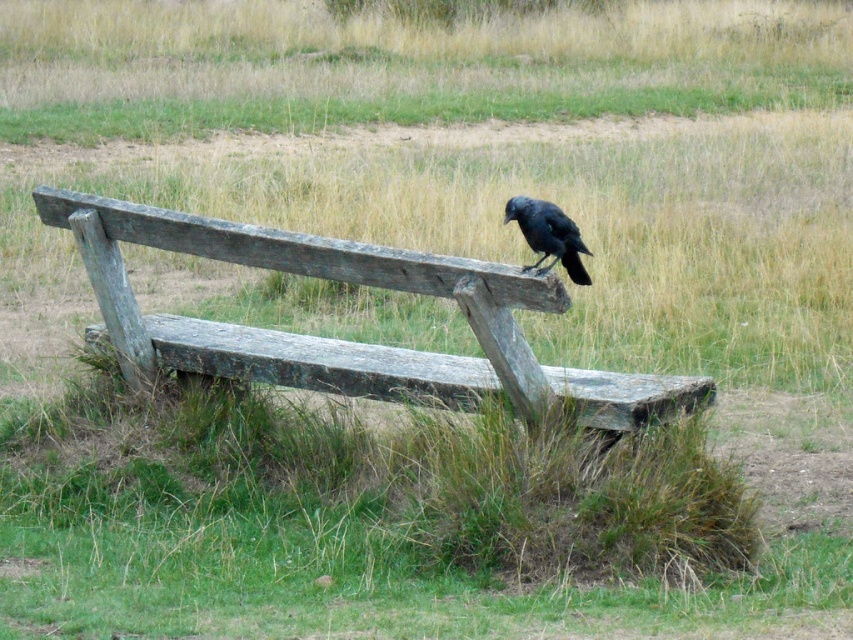
Question: Among these points, which one is nearest to the camera?

Choices:
 (A) (532, 200)
 (B) (648, 385)

Answer: (A)

Question: Is weathered wood bench at center positioned before shiny black raven at upper center?

Choices:
 (A) yes
 (B) no

Answer: (A)

Question: Is weathered wood bench at center wider than shiny black raven at upper center?

Choices:
 (A) no
 (B) yes

Answer: (B)

Question: Which object is closer to the camera taking this photo?

Choices:
 (A) weathered wood bench at center
 (B) shiny black raven at upper center

Answer: (A)

Question: Can you confirm if weathered wood bench at center is bigger than shiny black raven at upper center?

Choices:
 (A) no
 (B) yes

Answer: (B)

Question: Which point is closer to the camera?

Choices:
 (A) (322, 248)
 (B) (555, 221)

Answer: (A)